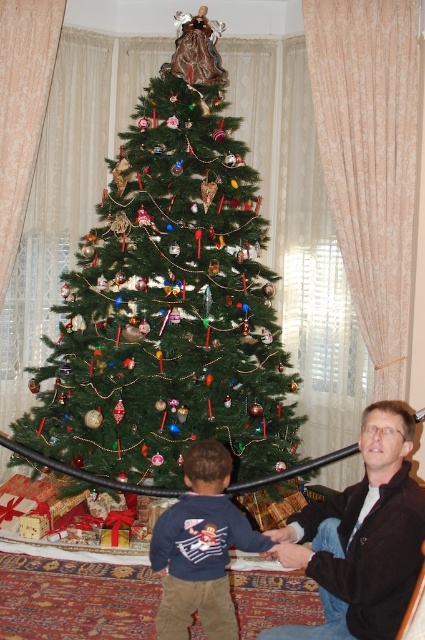
Question: Which object appears farthest from the camera in this image?

Choices:
 (A) dark brown leather jacket at lower right
 (B) dark blue sweater at lower center
 (C) green matte christmas tree at center

Answer: (C)

Question: Does green matte christmas tree at center have a larger size compared to dark brown leather jacket at lower right?

Choices:
 (A) yes
 (B) no

Answer: (A)

Question: Is dark brown leather jacket at lower right to the right of dark blue sweater at lower center from the viewer's perspective?

Choices:
 (A) no
 (B) yes

Answer: (B)

Question: Which point is farther to the camera?

Choices:
 (A) dark brown leather jacket at lower right
 (B) green matte christmas tree at center
 (C) dark blue sweater at lower center

Answer: (B)

Question: From the image, what is the correct spatial relationship of green matte christmas tree at center in relation to dark brown leather jacket at lower right?

Choices:
 (A) above
 (B) below

Answer: (A)

Question: Among these points, which one is nearest to the camera?

Choices:
 (A) (189, 608)
 (B) (322, 573)

Answer: (B)